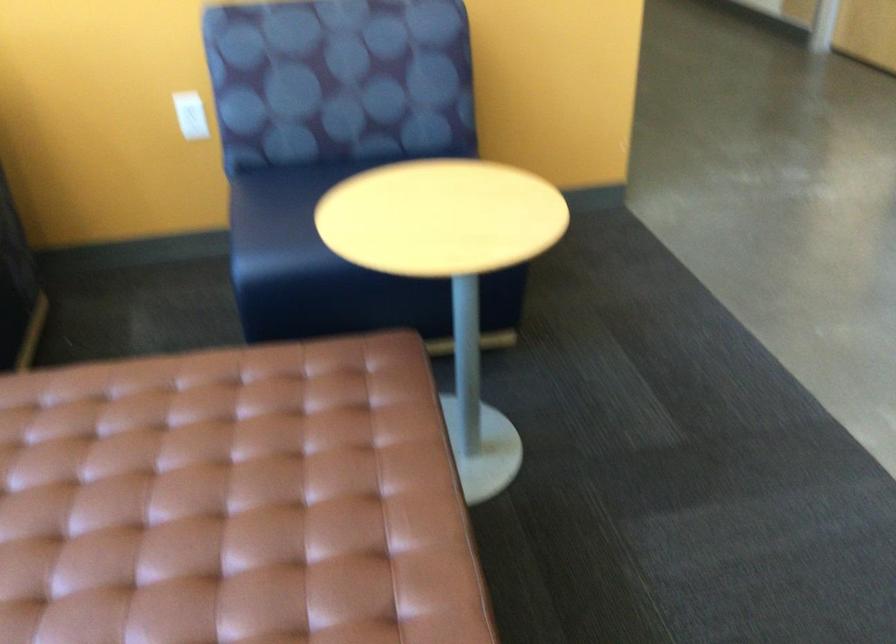
The width and height of the screenshot is (896, 644). What do you see at coordinates (282, 210) in the screenshot? I see `a sofa sitting surface` at bounding box center [282, 210].